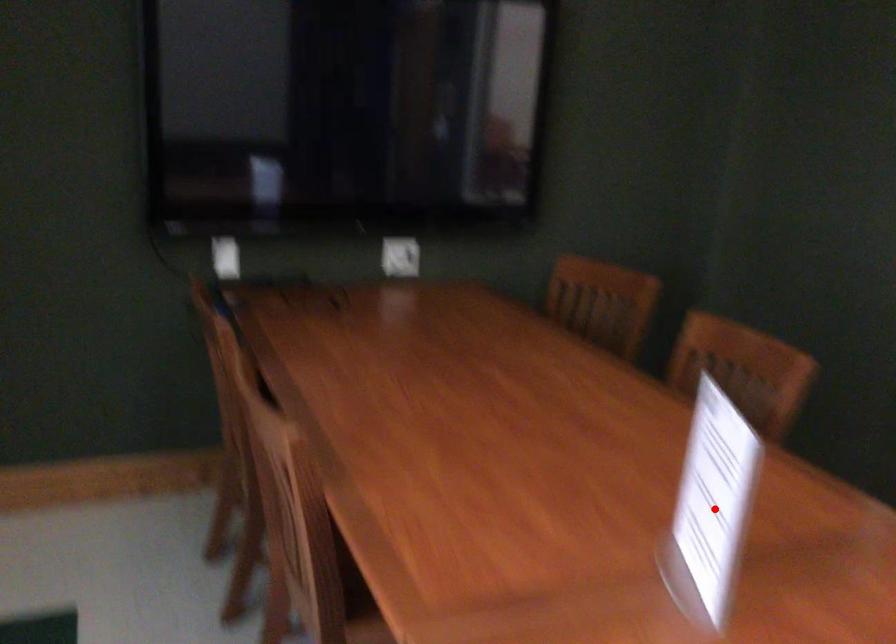
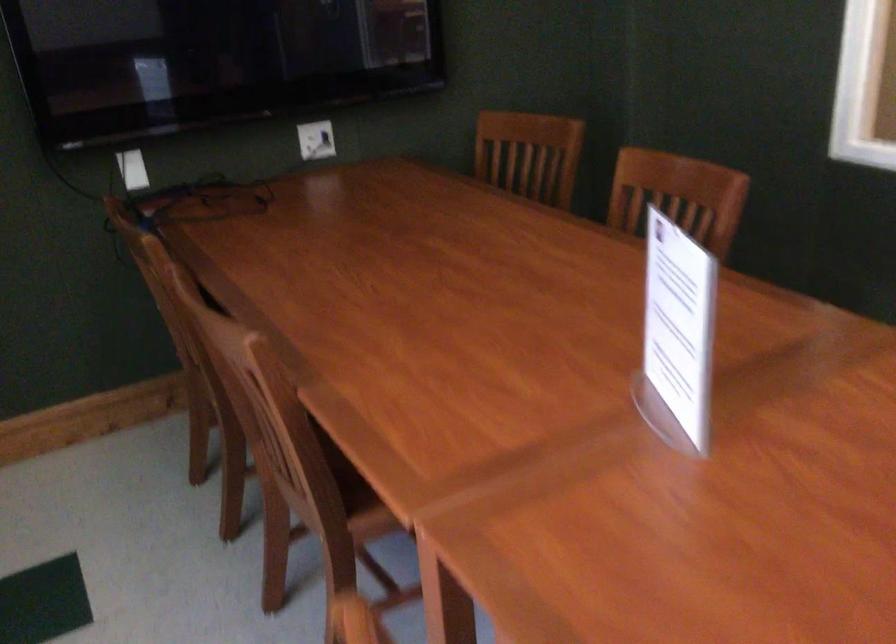
Question: I am providing you with two images of the same scene from different viewpoints. A red point is marked on the first image. Can you still see the location of the red point in image 2?

Choices:
 (A) Yes
 (B) No

Answer: (A)